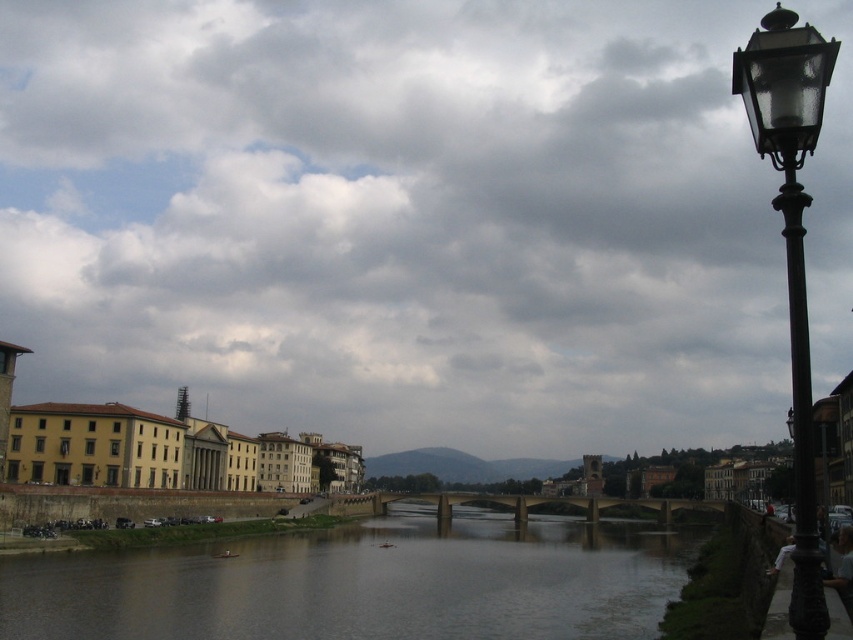
Measure the distance between brown concrete river at center and polished brass lamp post at right.

The distance of brown concrete river at center from polished brass lamp post at right is 196.67 feet.

Does brown concrete river at center appear over polished brass lamp post at right?

No, brown concrete river at center is not above polished brass lamp post at right.

Identify the location of brown concrete river at center. The height and width of the screenshot is (640, 853). (364, 582).